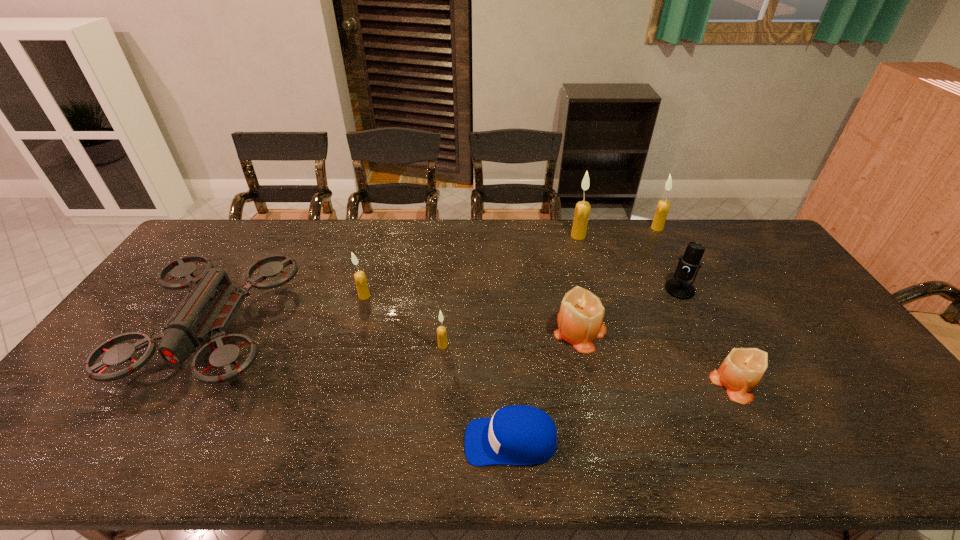
This screenshot has height=540, width=960. What are the coordinates of `gray drone` in the screenshot? It's located at (207, 310).

Locate an element on the screen. the nearest cream candle is located at coordinates (441, 330).

Where is `the fifth candle from right to left`? This screenshot has width=960, height=540. the fifth candle from right to left is located at coordinates (441, 330).

The width and height of the screenshot is (960, 540). I want to click on the nearest candle, so pos(741,371).

The height and width of the screenshot is (540, 960). I want to click on the nearer beige candle, so click(x=741, y=371).

At what (x,y) coordinates should I click in order to perform the action: click on the shortest object. Please return your answer as a coordinate pair (x, y). The image size is (960, 540). Looking at the image, I should click on 515,435.

You are a GUI agent. You are given a task and a screenshot of the screen. Output one action in this format:
    pyautogui.click(x=<x>, y=<y>)
    Task: Click on the baseball cap
    
    Given the screenshot: What is the action you would take?
    pyautogui.click(x=515, y=435)

Where is `free spot located on the front of the biggest cream candle`? The width and height of the screenshot is (960, 540). free spot located on the front of the biggest cream candle is located at coordinates (594, 293).

Where is `free space located 0.230m on the front of the rightmost cream candle`? free space located 0.230m on the front of the rightmost cream candle is located at coordinates (680, 272).

Where is `vacant region located 0.160m on the back of the third farthest candle`? vacant region located 0.160m on the back of the third farthest candle is located at coordinates (374, 260).